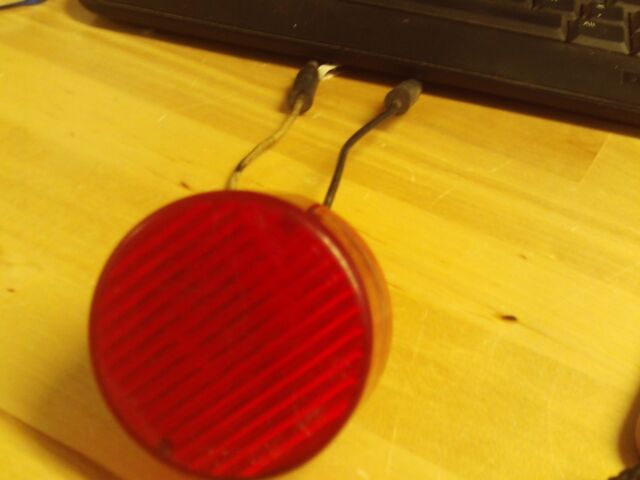
Where is `keys on keyboard`? The width and height of the screenshot is (640, 480). keys on keyboard is located at coordinates [616, 45], [616, 3], [548, 8].